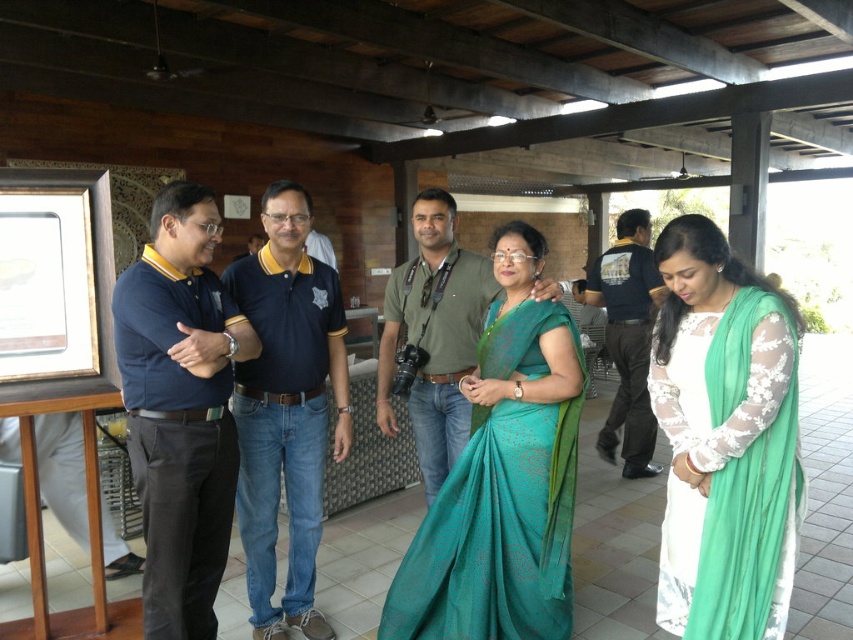
You are organizing a charity event and need to arrange seating for two guests wearing the white lace dress at lower right and the dark blue shirt at center. Which guest requires a larger seat?

The dark blue shirt at center requires a larger seat because it is bigger than the white lace dress at lower right.

You are a photographer standing at the back of the pavilion. You want to take a photo of the white lace dress at lower right and the dark blue shirt at center. Which one should you focus on first to ensure both are in sharp focus?

The white lace dress at lower right is closer to the viewer than the dark blue shirt at center. To ensure both are in sharp focus, you should focus on the dark blue shirt at center first, as it is farther away and adjusting focus from there will help capture both subjects effectively.